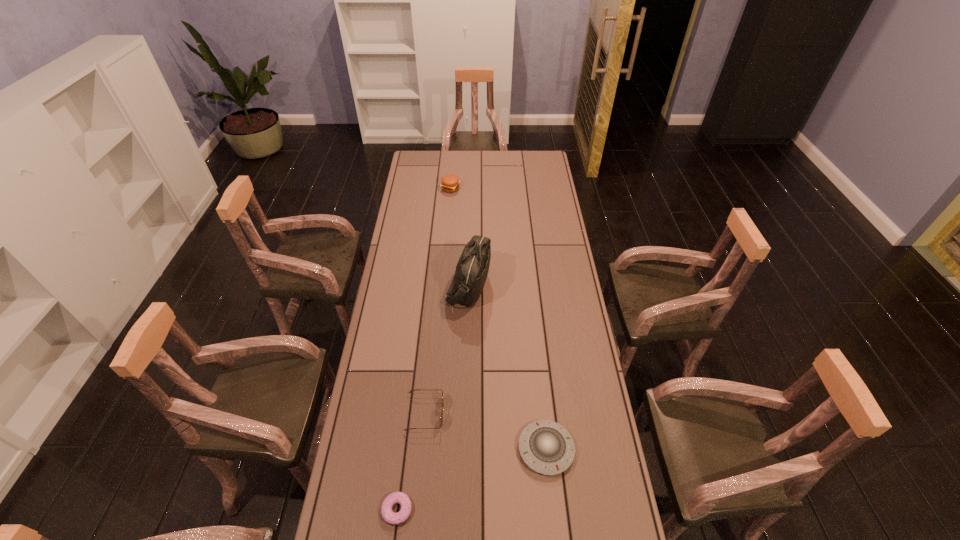
Identify which object is the closest to the tallest object. Please provide its 2D coordinates. Your answer should be formatted as a tuple, i.e. [(x, y)], where the tuple contains the x and y coordinates of a point satisfying the conditions above.

[(441, 417)]

At what (x,y) coordinates should I click in order to perform the action: click on vacant region that satisfies the following two spatial constraints: 1. on the back side of the rightmost object; 2. on the lenses of the sunglasses. Please return your answer as a coordinate pair (x, y). Image resolution: width=960 pixels, height=540 pixels. Looking at the image, I should click on (542, 413).

Locate an element on the screen. The height and width of the screenshot is (540, 960). free space that satisfies the following two spatial constraints: 1. on the back side of the farthest object; 2. on the right side of the doughnut is located at coordinates (x=436, y=188).

Locate an element on the screen. Image resolution: width=960 pixels, height=540 pixels. free space that satisfies the following two spatial constraints: 1. on the back side of the rightmost object; 2. on the lenses of the sunglasses is located at coordinates (542, 413).

Find the location of a particular element. The width and height of the screenshot is (960, 540). vacant space that satisfies the following two spatial constraints: 1. at the front padded panel of the tallest object; 2. on the front side of the nearest object is located at coordinates (463, 510).